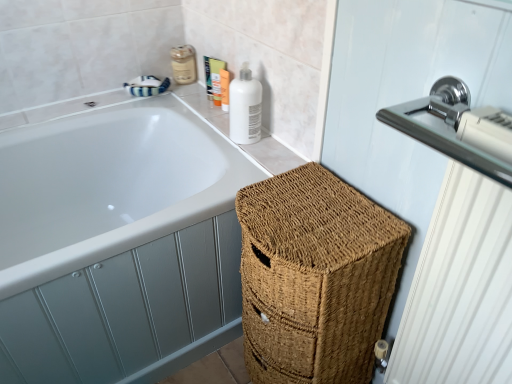
Question: Is polished chrome radiator at upper right situated inside chrome metallic sink at upper right or outside?

Choices:
 (A) outside
 (B) inside

Answer: (A)

Question: From the image's perspective, is polished chrome radiator at upper right positioned above or below chrome metallic sink at upper right?

Choices:
 (A) below
 (B) above

Answer: (A)

Question: Estimate the real-world distances between objects in this image. Which object is closer to the matte orange tube at upper center, the third toiletry positioned from the left?

Choices:
 (A) chrome metallic sink at upper right
 (B) matte beige lotion at upper center, the 1th toiletry when ordered from left to right
 (C) matte white lotion at upper right, the 1th toiletry from the right
 (D) white glossy bottle at upper right
 (E) polished chrome radiator at upper right

Answer: (C)

Question: Estimate the real-world distances between objects in this image. Which object is closer to the matte beige lotion at upper center, the fourth toiletry positioned from the right?

Choices:
 (A) braided wicker basket at lower right
 (B) matte white lotion at upper right, arranged as the 4th toiletry when viewed from the left
 (C) matte orange tube at upper center, the third toiletry positioned from the left
 (D) white glossy bottle at upper right
 (E) matte plastic tube at upper center, acting as the second toiletry starting from the left

Answer: (E)